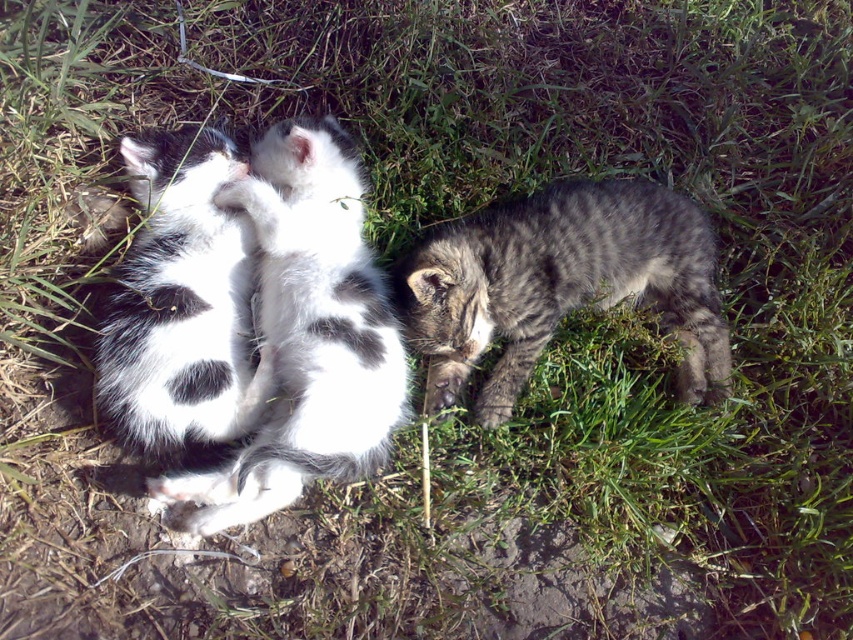
Question: Which point appears farthest from the camera in this image?

Choices:
 (A) (222, 396)
 (B) (302, 406)

Answer: (A)

Question: Can you confirm if black and white fur kitten at center is positioned to the right of white soft fur kitten at center?

Choices:
 (A) yes
 (B) no

Answer: (A)

Question: Is gray striped kitten at center to the right of white soft fur kitten at center from the viewer's perspective?

Choices:
 (A) yes
 (B) no

Answer: (A)

Question: Which point is closer to the camera?

Choices:
 (A) white soft fur kitten at center
 (B) gray striped kitten at center

Answer: (A)

Question: Which object appears closest to the camera in this image?

Choices:
 (A) gray striped kitten at center
 (B) black and white fur kitten at center
 (C) white soft fur kitten at center

Answer: (B)

Question: Where is black and white fur kitten at center located in relation to white soft fur kitten at center in the image?

Choices:
 (A) above
 (B) below

Answer: (B)